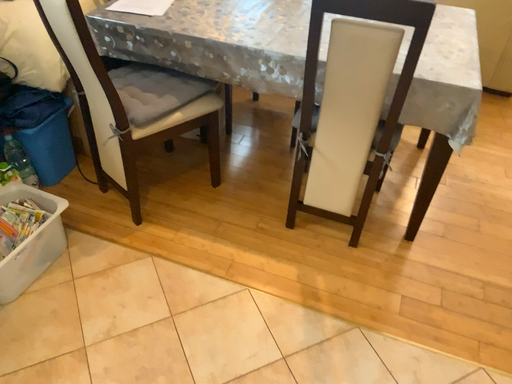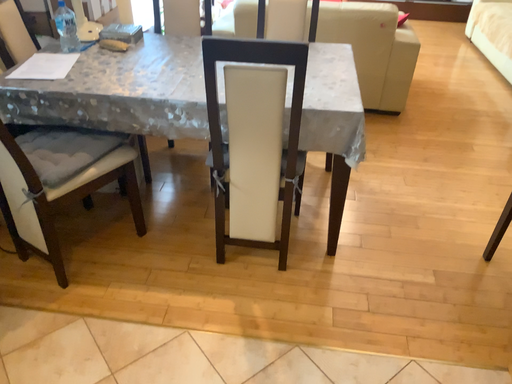
Question: Which way did the camera rotate in the video?

Choices:
 (A) rotated downward
 (B) rotated upward

Answer: (B)